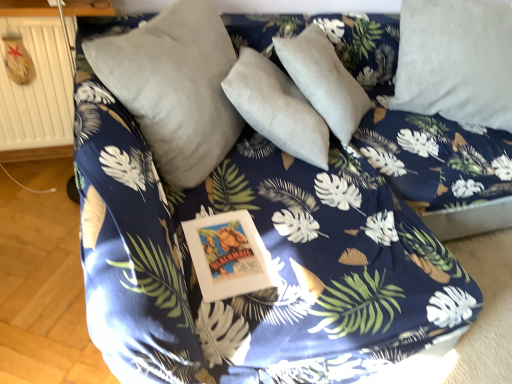
Question: From a real-world perspective, is satin gray pillow at center, the 2th pillow from the right, located higher than white soft pillow at upper right, positioned as the first pillow in right-to-left order?

Choices:
 (A) yes
 (B) no

Answer: (A)

Question: Considering the relative sizes of satin gray pillow at center, which is the 1th pillow from left to right, and white soft pillow at upper right, which is the second pillow from left to right, in the image provided, is satin gray pillow at center, which is the 1th pillow from left to right, shorter than white soft pillow at upper right, which is the second pillow from left to right,?

Choices:
 (A) yes
 (B) no

Answer: (B)

Question: Considering the relative positions of satin gray pillow at center, which is the 1th pillow from left to right, and white soft pillow at upper right, positioned as the first pillow in right-to-left order, in the image provided, is satin gray pillow at center, which is the 1th pillow from left to right, in front of white soft pillow at upper right, positioned as the first pillow in right-to-left order,?

Choices:
 (A) no
 (B) yes

Answer: (B)

Question: From the image's perspective, is satin gray pillow at center, the 2th pillow from the right, beneath white soft pillow at upper right, which is the second pillow from left to right?

Choices:
 (A) no
 (B) yes

Answer: (B)

Question: Could you tell me if satin gray pillow at center, which is the 1th pillow from left to right, is facing white soft pillow at upper right, positioned as the first pillow in right-to-left order?

Choices:
 (A) no
 (B) yes

Answer: (A)

Question: Is satin gray pillow at center, which is the 1th pillow from left to right, directly adjacent to white soft pillow at upper right, positioned as the first pillow in right-to-left order?

Choices:
 (A) no
 (B) yes

Answer: (A)

Question: From a real-world perspective, is satin gray pillow at center, the 2th pillow from the right, over beige wooden radiator at left?

Choices:
 (A) yes
 (B) no

Answer: (A)

Question: Does satin gray pillow at center, the 2th pillow from the right, have a greater height compared to beige wooden radiator at left?

Choices:
 (A) yes
 (B) no

Answer: (A)

Question: Does satin gray pillow at center, the 2th pillow from the right, have a lesser width compared to beige wooden radiator at left?

Choices:
 (A) no
 (B) yes

Answer: (A)

Question: Is there a large distance between satin gray pillow at center, the 2th pillow from the right, and beige wooden radiator at left?

Choices:
 (A) yes
 (B) no

Answer: (B)

Question: Is satin gray pillow at center, which is the 1th pillow from left to right, looking in the opposite direction of beige wooden radiator at left?

Choices:
 (A) yes
 (B) no

Answer: (A)

Question: Can you confirm if satin gray pillow at center, which is the 1th pillow from left to right, is shorter than beige wooden radiator at left?

Choices:
 (A) yes
 (B) no

Answer: (B)

Question: Does beige wooden radiator at left touch satin gray pillow at center, the 2th pillow from the right?

Choices:
 (A) no
 (B) yes

Answer: (A)